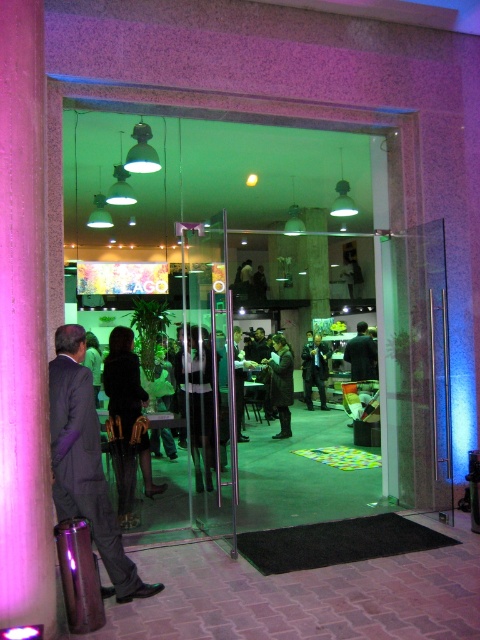
Does matte black suit at left have a larger size compared to dark brown leather jacket at center?

Indeed, matte black suit at left has a larger size compared to dark brown leather jacket at center.

Between matte black suit at left and dark brown leather jacket at center, which one appears on the right side from the viewer's perspective?

dark brown leather jacket at center

Identify the location of matte black suit at left. The width and height of the screenshot is (480, 640). (84, 461).

Between dark brown leather jacket at center and dark green fabric jacket at center, which one appears on the right side from the viewer's perspective?

dark green fabric jacket at center is more to the right.

Which is behind, point (280, 356) or point (375, 371)?

Positioned behind is point (375, 371).

Consider the image. Who is more distant from viewer, (287, 369) or (364, 324)?

Positioned behind is point (364, 324).

Identify the location of dark brown leather jacket at center. (282, 384).

Between dark suit at center and dark green fabric jacket at center, which one is positioned lower?

dark suit at center

Does dark suit at center lie in front of dark green fabric jacket at center?

No.

Does point (311, 371) come behind point (359, 365)?

Yes, it is.

Where is `dark suit at center`? Image resolution: width=480 pixels, height=640 pixels. dark suit at center is located at coordinates (314, 369).